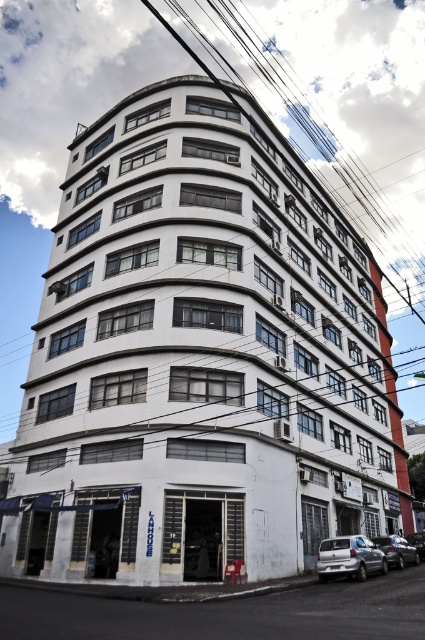
Question: Is white matte car at lower right below black wire at upper center?

Choices:
 (A) no
 (B) yes

Answer: (B)

Question: Is black wire at upper center in front of shiny black sedan at lower right?

Choices:
 (A) yes
 (B) no

Answer: (A)

Question: Which of the following is the farthest from the observer?

Choices:
 (A) black wire at upper center
 (B) shiny black sedan at lower right

Answer: (B)

Question: Which is farther from the black wire at upper center?

Choices:
 (A) white matte car at lower right
 (B) shiny black sedan at lower right
 (C) silver metallic sedan at lower right

Answer: (A)

Question: Which point is closer to the camera taking this photo?

Choices:
 (A) (380, 536)
 (B) (175, 29)
 (C) (340, 570)

Answer: (C)

Question: In this image, where is white matte car at lower right located relative to silver metallic sedan at lower right?

Choices:
 (A) right
 (B) left

Answer: (B)